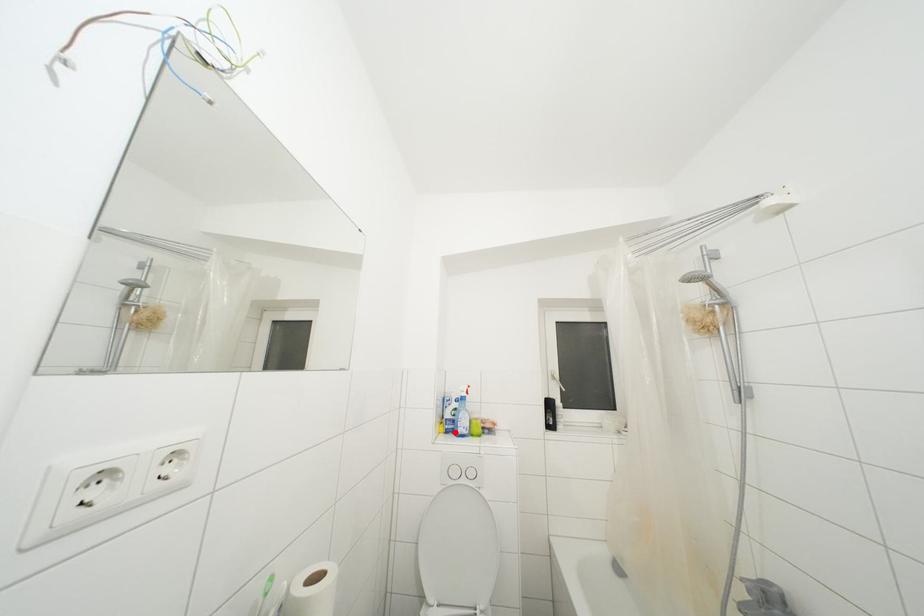
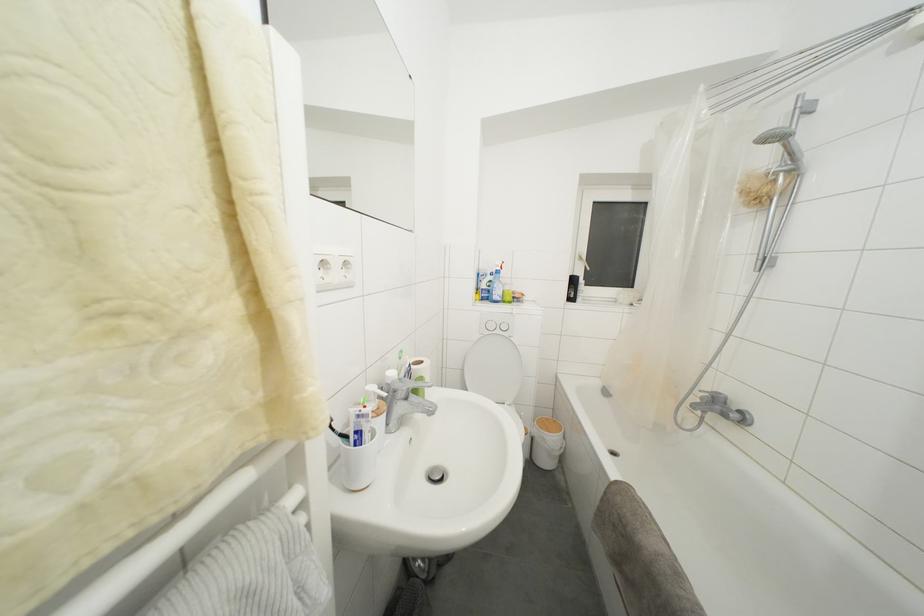
Question: I am providing you with two images of the same scene from different viewpoints. In image1, a red point is highlighted. Considering the same 3D point in image2, which of the following is correct?

Choices:
 (A) It is closer
 (B) It is farther

Answer: (A)